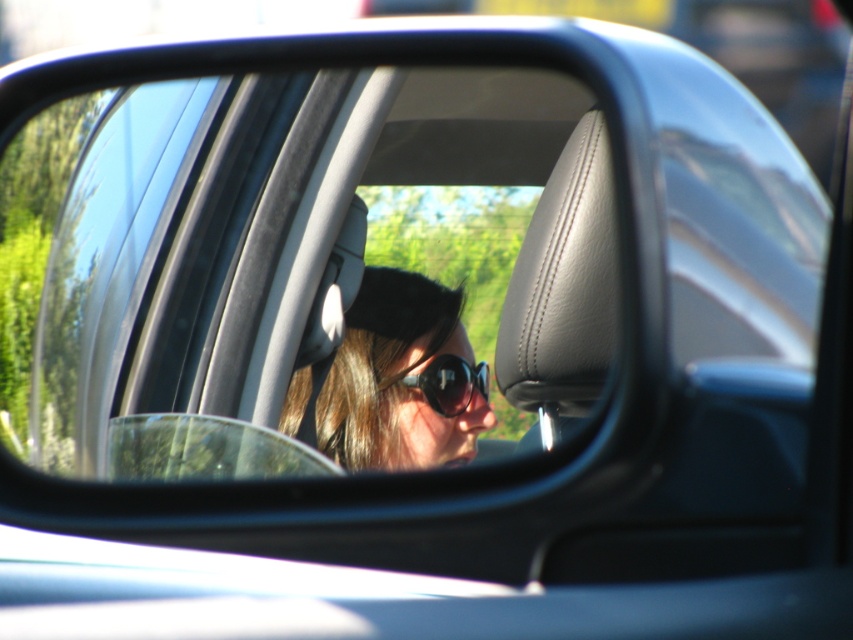
You are a passenger in the car and want to look at the view outside through the transparent glass car window at center and the clear glass car mirror at center. Which object allows you to see the greenery outside more clearly?

The transparent glass car window at center is positioned on the right side of the clear glass car mirror at center. Since the window is directly facing the outside environment, it provides a clearer view of the greenery compared to the mirror, which reflects the interior and exterior with some glare.

You are a passenger in the car and looking at the side mirror. You see two points reflected in the mirror. The first point is at coordinates point (527, 298) and the second is at point (480, 372). Which point is closer to you in the reflection?

Point (527, 298) is in front of point (480, 372) in the reflection, so it is closer to you.